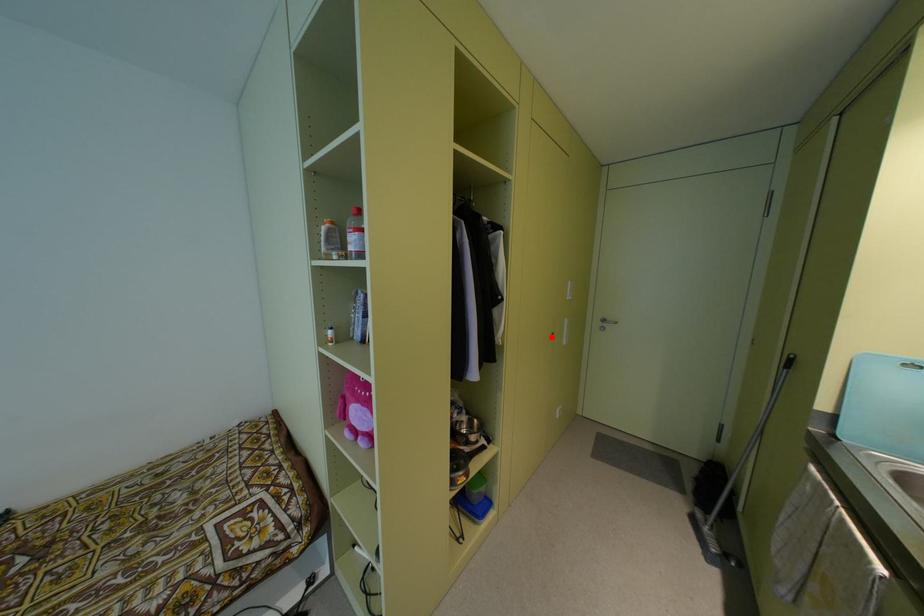
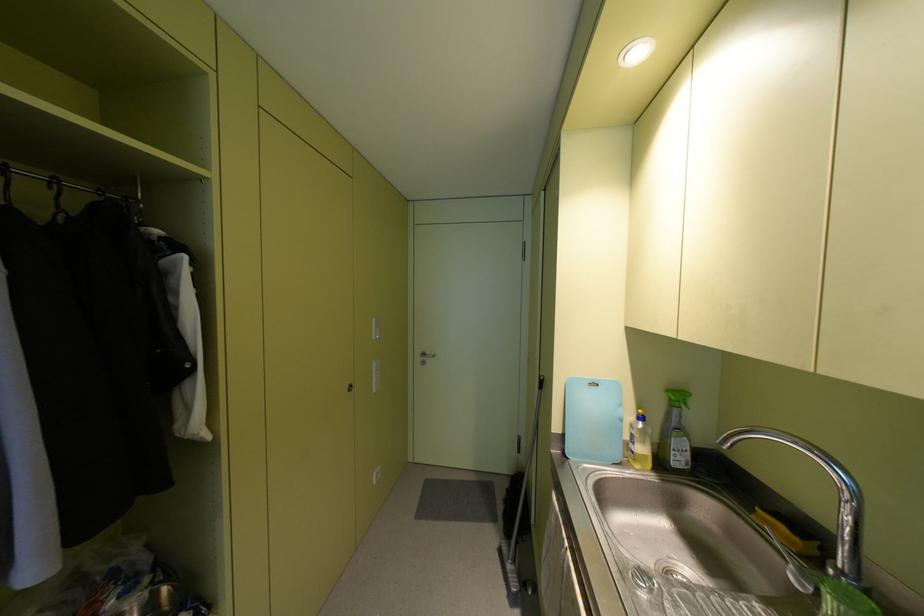
The point at the highlighted location is marked in the first image. Where is the corresponding point in the second image?

(348, 390)